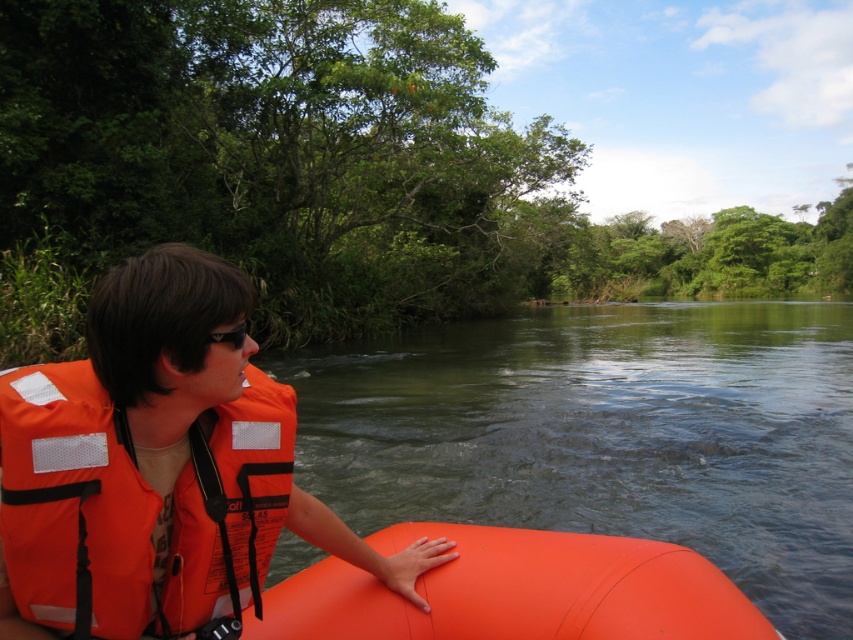
You are planning to store the orange life vest at left and the orange rubber boat at center in a storage container. Which object requires a larger storage space in terms of width?

The orange rubber boat at center requires a larger storage space in terms of width because its width is greater than the orange life vest at left.

Consider the image. You are a photographer trying to capture the scene of the person on the raft. You notice the green smooth water at center and the black plastic goggles at upper left in your viewfinder. Which object appears taller in the photo?

The green smooth water at center appears taller in the photo because it has a greater height compared to the black plastic goggles at upper left.

Looking at this image, you are a lifeguard trying to locate two items in the water. You see the orange life vest at left and the black plastic goggles at upper left. How far apart are these two items from each other?

The orange life vest at left and the black plastic goggles at upper left are 15.30 inches apart from each other.